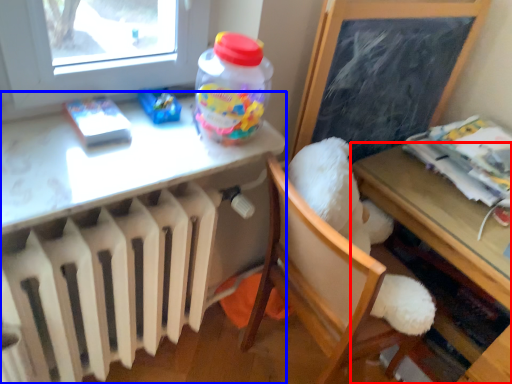
Question: Which object is closer to the camera taking this photo, table (highlighted by a red box) or desk (highlighted by a blue box)?

Choices:
 (A) table
 (B) desk

Answer: (B)